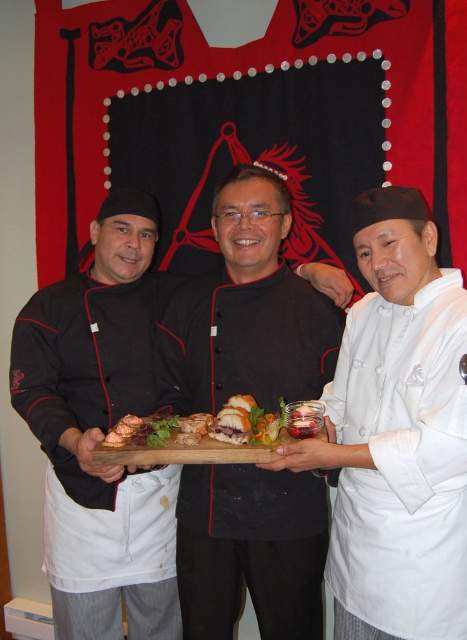
You are standing in front of the three chefs in the image. You notice two points marked on the floor. The first point is at coordinate point(439, 422) and the second point is at coordinate point(64, 362). If you were to walk from the first point to the second point, would you be moving towards the chefs or away from them?

Since point(439, 422) is in front of point(64, 362), moving from the first point to the second point would mean you are moving away from the chefs.

You are a food critic standing in front of the three chefs. You notice the white matte chef coat at center and the golden brown bread at center. Which object is higher in height?

The white matte chef coat at center is taller than the golden brown bread at center.

You are a food critic standing 5 feet away from the tapestry. You want to take a photo of the white matte chef coat at center without including the tapestry in the background. Is the distance sufficient?

The white matte chef coat at center is 3.73 feet away from the viewer. Since you are standing 5 feet away from the tapestry, the distance between you and the coat is greater than the required 3.73 feet, so you can take the photo without including the tapestry.